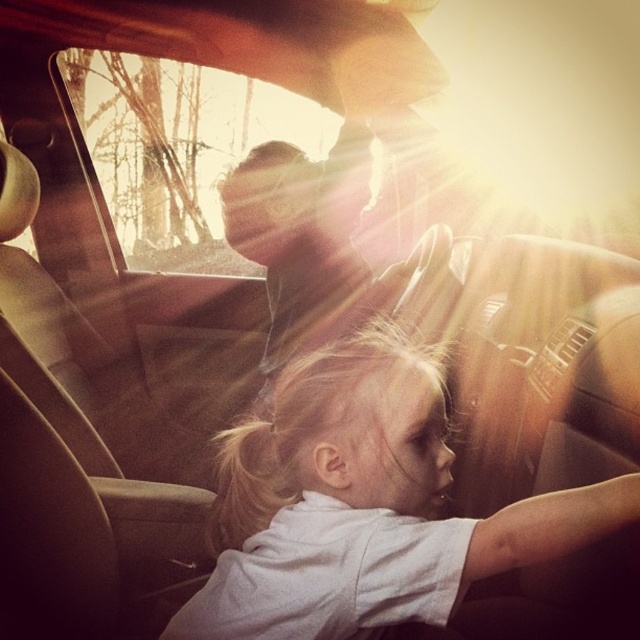
You are a passenger in the car and want to see the view outside through the transparent glass car window at upper center. However, your white cotton shirt at center is blocking your view. Can you lift your shirt to see through the window?

The white cotton shirt at center is shorter than the transparent glass car window at upper center, so lifting the shirt would allow you to see through the transparent glass car window at upper center since the shirt is not as tall as the window.

You are a passenger in the car and want to see the view outside through the transparent glass car window at upper center. However, the white cotton shirt at center is blocking your view. Can you move the shirt to the side to get a better look?

The white cotton shirt at center is in front of the transparent glass car window at upper center, so you can move the shirt to the side to get a better look.

You are a passenger in the car and want to look at the scenery outside through the transparent glass car window at upper center. However, your white cotton shirt at center is blocking your view. Which direction should you move your shirt to the left or right to get a clear view?

The white cotton shirt at center is to the right of the transparent glass car window at upper center. To get a clear view, you should move your shirt to the left.